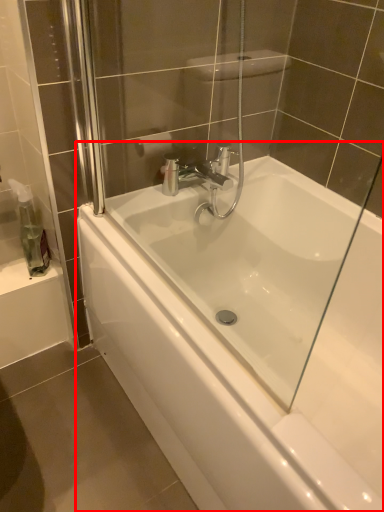
Question: From the image's perspective, what is the correct spatial positioning of bathtub (annotated by the red box) in reference to soap dispenser?

Choices:
 (A) above
 (B) below

Answer: (B)